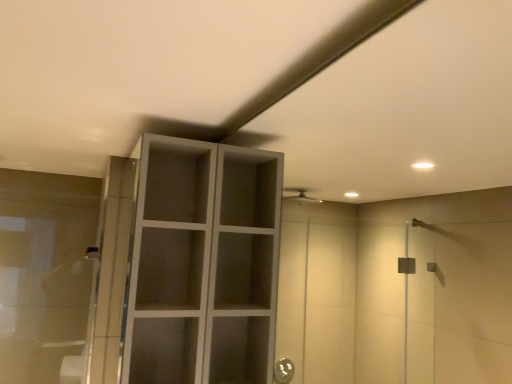
Question: Considering the positions of matte gray cabinet at upper center and transparent glass cabinet at left in the image, is matte gray cabinet at upper center bigger or smaller than transparent glass cabinet at left?

Choices:
 (A) small
 (B) big

Answer: (B)

Question: Would you say matte gray cabinet at upper center is inside or outside transparent glass cabinet at left?

Choices:
 (A) inside
 (B) outside

Answer: (B)

Question: Is matte gray cabinet at upper center taller or shorter than transparent glass cabinet at left?

Choices:
 (A) tall
 (B) short

Answer: (A)

Question: Looking at their shapes, would you say transparent glass cabinet at left is wider or thinner than matte gray cabinet at upper center?

Choices:
 (A) thin
 (B) wide

Answer: (A)

Question: Is transparent glass cabinet at left taller or shorter than matte gray cabinet at upper center?

Choices:
 (A) short
 (B) tall

Answer: (A)

Question: Looking at the image, does transparent glass cabinet at left seem bigger or smaller compared to matte gray cabinet at upper center?

Choices:
 (A) small
 (B) big

Answer: (A)

Question: From the image's perspective, is transparent glass cabinet at left located above or below matte gray cabinet at upper center?

Choices:
 (A) below
 (B) above

Answer: (A)